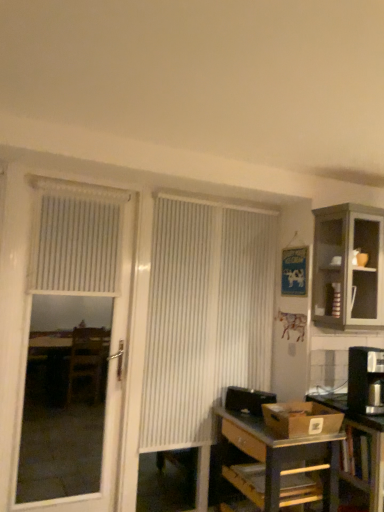
Locate an element on the screen. white vertical blinds at center is located at coordinates (204, 316).

The width and height of the screenshot is (384, 512). Describe the element at coordinates (371, 445) in the screenshot. I see `metallic silver table at lower right` at that location.

The height and width of the screenshot is (512, 384). I want to click on white textured blind at upper left, so click(x=75, y=239).

The width and height of the screenshot is (384, 512). Describe the element at coordinates (365, 380) in the screenshot. I see `black plastic coffee maker at right` at that location.

In order to face white textured screen door at left, should I rotate leftwards or rightwards?

Rotate left and turn 15.648 degrees.

Where is `white vertical blinds at center`? white vertical blinds at center is located at coordinates (204, 316).

How much distance is there between white textured blind at upper left and white textured screen door at left?

The distance of white textured blind at upper left from white textured screen door at left is 4.49 feet.

Considering the relative positions of white textured blind at upper left and white textured screen door at left in the image provided, is white textured blind at upper left to the left of white textured screen door at left from the viewer's perspective?

In fact, white textured blind at upper left is to the right of white textured screen door at left.

From the image's perspective, is white textured blind at upper left above white textured screen door at left?

Yes, from the image's perspective, white textured blind at upper left is on top of white textured screen door at left.

Which of these two, white textured blind at upper left or white textured screen door at left, stands shorter?

With less height is white textured blind at upper left.

How far apart are white textured screen door at left and white vertical blinds at center?

4.40 feet.

From a real-world perspective, does white textured screen door at left sit lower than white vertical blinds at center?

Indeed, from a real-world perspective, white textured screen door at left is positioned beneath white vertical blinds at center.

From the image's perspective, which one is positioned lower, white textured screen door at left or white vertical blinds at center?

white textured screen door at left is shown below in the image.

Visually, is white textured screen door at left positioned to the left or to the right of white vertical blinds at center?

white textured screen door at left is to the left of white vertical blinds at center.

Is white textured screen door at left thinner than black plastic coffee maker at right?

Yes, white textured screen door at left is thinner than black plastic coffee maker at right.

Considering their positions, is white textured screen door at left located in front of or behind black plastic coffee maker at right?

white textured screen door at left is behind black plastic coffee maker at right.

The height and width of the screenshot is (512, 384). Identify the location of appliance lying in front of the white textured screen door at left. (365, 380).

Can black plastic coffee maker at right be found inside white textured screen door at left?

That's incorrect, black plastic coffee maker at right is not inside white textured screen door at left.

Is white textured screen door at left smaller than metallic silver table at lower right?

Correct, white textured screen door at left occupies less space than metallic silver table at lower right.

From the image's perspective, is white textured screen door at left beneath metallic silver table at lower right?

No, from the image's perspective, white textured screen door at left is not below metallic silver table at lower right.

What's the angular difference between white textured screen door at left and metallic silver table at lower right's facing directions?

white textured screen door at left and metallic silver table at lower right are facing 0.853 degrees away from each other.

Which object is positioned more to the right, white textured screen door at left or metallic silver table at lower right?

metallic silver table at lower right.

Between metallic silver table at lower right and matte gray cabinet at upper right, which one has smaller size?

Smaller between the two is matte gray cabinet at upper right.

Considering the positions of points (336, 405) and (341, 227), is point (336, 405) closer to camera compared to point (341, 227)?

Yes, point (336, 405) is in front of point (341, 227).

Is metallic silver table at lower right spatially inside matte gray cabinet at upper right, or outside of it?

metallic silver table at lower right is outside matte gray cabinet at upper right.

In the scene shown: From a real-world perspective, is metallic silver table at lower right positioned under matte gray cabinet at upper right based on gravity?

Indeed, from a real-world perspective, metallic silver table at lower right is positioned beneath matte gray cabinet at upper right.

Is black plastic coffee maker at right looking in the opposite direction of white textured screen door at left?

No, white textured screen door at left is not at the back of black plastic coffee maker at right.

Would you say black plastic coffee maker at right is to the left or to the right of white textured screen door at left in the picture?

Based on their positions, black plastic coffee maker at right is located to the right of white textured screen door at left.

Is white textured screen door at left surrounded by black plastic coffee maker at right?

No, white textured screen door at left is not surrounded by black plastic coffee maker at right.

From the image's perspective, is white textured screen door at left under white textured blind at upper left?

Correct, white textured screen door at left appears lower than white textured blind at upper left in the image.

Is white textured screen door at left wider or thinner than white textured blind at upper left?

white textured screen door at left is wider than white textured blind at upper left.

Is white textured blind at upper left at the back of white textured screen door at left?

Yes, white textured screen door at left is positioned with its back facing white textured blind at upper left.

Identify the location of screen door on the left of white textured blind at upper left. (63, 340).

At what (x,y) coordinates should I click in order to perform the action: click on screen door below the white vertical blinds at center (from the image's perspective). Please return your answer as a coordinate pair (x, y). This screenshot has width=384, height=512. Looking at the image, I should click on (63, 340).

Estimate the real-world distances between objects in this image. Which object is closer to white textured blind at upper left, black plastic coffee maker at right or metallic gray desk at lower right?

The object closer to white textured blind at upper left is metallic gray desk at lower right.

From the image, which object appears to be nearer to black plastic coffee maker at right, white textured blind at upper left or matte gray cabinet at upper right?

Among the two, matte gray cabinet at upper right is located nearer to black plastic coffee maker at right.

Looking at the image, which one is located further to white textured screen door at left, matte gray cabinet at upper right or black plastic coffee maker at right?

black plastic coffee maker at right is positioned further to the anchor white textured screen door at left.

From the picture: Looking at the image, which one is located closer to white vertical blinds at center, matte gray cabinet at upper right or metallic silver table at lower right?

Based on the image, matte gray cabinet at upper right appears to be nearer to white vertical blinds at center.

Which object lies nearer to the anchor point white vertical blinds at center, black plastic coffee maker at right or white textured screen door at left?

Based on the image, black plastic coffee maker at right appears to be nearer to white vertical blinds at center.

Estimate the real-world distances between objects in this image. Which object is further from matte gray cabinet at upper right, white vertical blinds at center or white textured blind at upper left?

The object further to matte gray cabinet at upper right is white textured blind at upper left.

From the image, which object appears to be nearer to black plastic coffee maker at right, metallic silver table at lower right or white vertical blinds at center?

Based on the image, metallic silver table at lower right appears to be nearer to black plastic coffee maker at right.

Considering their positions, is metallic silver table at lower right positioned closer to white textured screen door at left than white textured blind at upper left?

white textured blind at upper left.

Where is `screen door between white textured blind at upper left and metallic gray desk at lower right from top to bottom`? This screenshot has height=512, width=384. screen door between white textured blind at upper left and metallic gray desk at lower right from top to bottom is located at coordinates (63, 340).

Where is `table that lies between matte gray cabinet at upper right and metallic gray desk at lower right from top to bottom`? The image size is (384, 512). table that lies between matte gray cabinet at upper right and metallic gray desk at lower right from top to bottom is located at coordinates (371, 445).

Where is `table between white vertical blinds at center and metallic gray desk at lower right in the vertical direction`? This screenshot has height=512, width=384. table between white vertical blinds at center and metallic gray desk at lower right in the vertical direction is located at coordinates pyautogui.click(x=371, y=445).

I want to click on curtain located between white textured blind at upper left and black plastic coffee maker at right in the left-right direction, so click(204, 316).